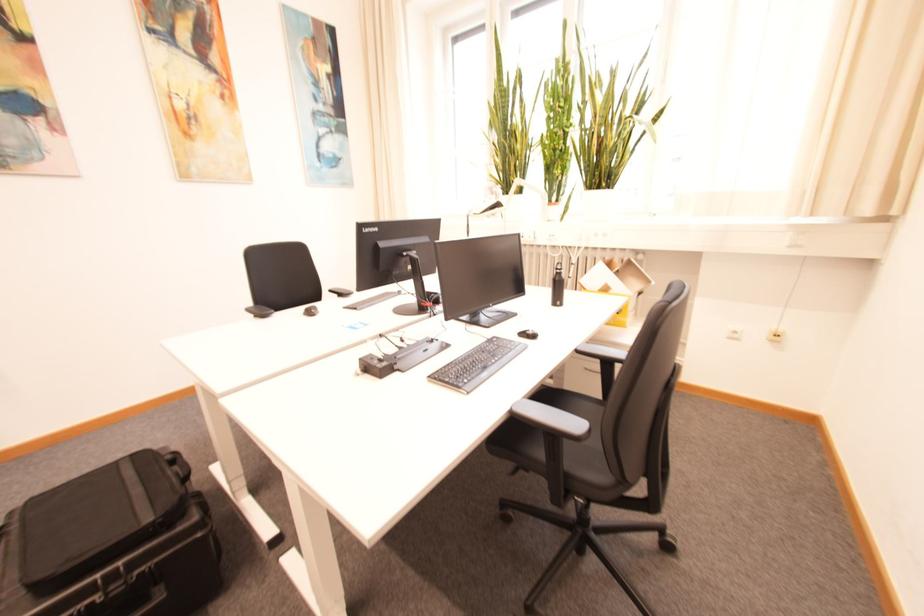
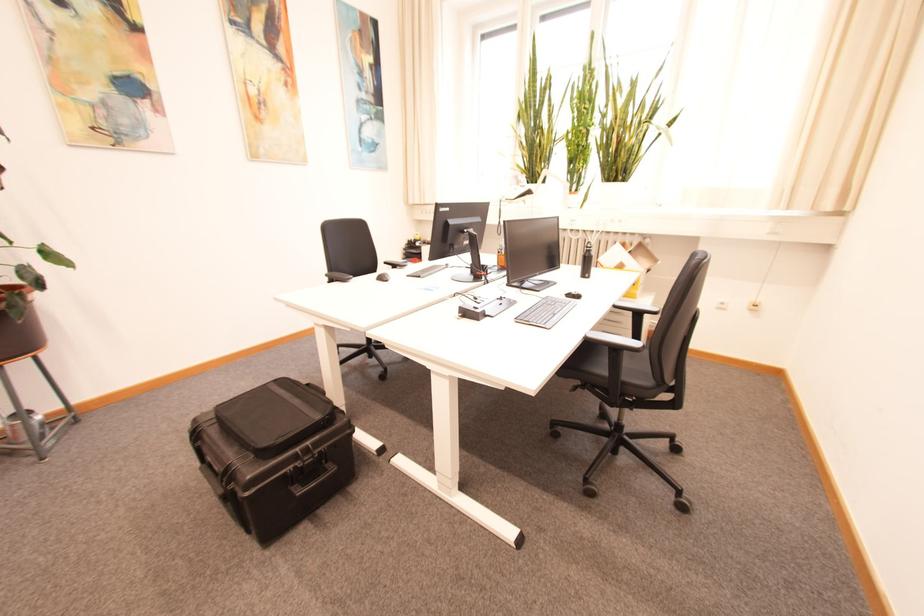
In the second image, find the point that corresponds to pixel 435 378 in the first image.

(523, 320)